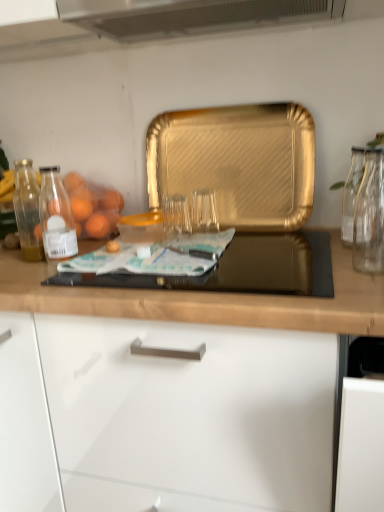
Measure the distance between transparent glass at center, the 1th glass jar from the left, and camera.

transparent glass at center, the 1th glass jar from the left, and camera are 1.19 meters apart from each other.

What is the approximate width of gold textured tray at center?

The width of gold textured tray at center is 3.92 inches.

What do you see at coordinates (237, 162) in the screenshot?
I see `gold textured tray at center` at bounding box center [237, 162].

Locate an element on the screen. Image resolution: width=384 pixels, height=512 pixels. transparent glass at center, which appears as the 2th glass jar when viewed from the right is located at coordinates (175, 217).

Is point (209, 163) positioned behind point (289, 237)?

That is True.

Considering the relative sizes of gold textured tray at center and black glass gas stove at center in the image provided, is gold textured tray at center thinner than black glass gas stove at center?

Yes.

Can you confirm if gold textured tray at center is positioned to the left of black glass gas stove at center?

No, gold textured tray at center is not to the left of black glass gas stove at center.

Does gold textured tray at center have a greater height compared to black glass gas stove at center?

Indeed, gold textured tray at center has a greater height compared to black glass gas stove at center.

Which is more to the right, translucent glass oranges at left or clear glass vase at right, marked as the 1th glass jar in a right-to-left arrangement?

clear glass vase at right, marked as the 1th glass jar in a right-to-left arrangement, is more to the right.

Is translucent glass oranges at left aimed at clear glass vase at right, the second glass jar viewed from the left?

No.

Is clear glass vase at right, marked as the 1th glass jar in a right-to-left arrangement, completely or partially inside translucent glass oranges at left?

Definitely not — clear glass vase at right, marked as the 1th glass jar in a right-to-left arrangement, is not inside translucent glass oranges at left.

Considering the relative positions of black glass gas stove at center and gold textured tray at center in the image provided, is black glass gas stove at center to the right of gold textured tray at center from the viewer's perspective?

Incorrect, black glass gas stove at center is not on the right side of gold textured tray at center.

Can we say black glass gas stove at center lies outside gold textured tray at center?

black glass gas stove at center lies outside gold textured tray at center's area.

Are black glass gas stove at center and gold textured tray at center located far from each other?

No.

Is black glass gas stove at center oriented away from gold textured tray at center?

black glass gas stove at center does not have its back to gold textured tray at center.

From the image's perspective, which glass jar is the 1st one below the gold textured tray at center? Please provide its 2D coordinates.

[(353, 191)]

Which of these two, clear glass vase at right, marked as the 1th glass jar in a right-to-left arrangement, or gold textured tray at center, stands shorter?

clear glass vase at right, marked as the 1th glass jar in a right-to-left arrangement.

Considering the positions of objects clear glass vase at right, the second glass jar viewed from the left, and gold textured tray at center in the image provided, who is behind, clear glass vase at right, the second glass jar viewed from the left, or gold textured tray at center?

gold textured tray at center is further from the camera.

From the image's perspective, relative to translucent glass oranges at left, is clear glass vase at right, marked as the 1th glass jar in a right-to-left arrangement, above or below?

From the image's perspective, clear glass vase at right, marked as the 1th glass jar in a right-to-left arrangement, appears above translucent glass oranges at left.

Could translucent glass oranges at left be considered to be inside clear glass vase at right, the second glass jar viewed from the left?

No, translucent glass oranges at left is not surrounded by clear glass vase at right, the second glass jar viewed from the left.

From the picture: Based on their sizes in the image, would you say clear glass vase at right, marked as the 1th glass jar in a right-to-left arrangement, is bigger or smaller than translucent glass oranges at left?

Considering their sizes, clear glass vase at right, marked as the 1th glass jar in a right-to-left arrangement, takes up less space than translucent glass oranges at left.

Could you tell me if clear glass vase at right, the second glass jar viewed from the left, is turned towards translucent glass oranges at left?

No.

Considering the relative sizes of black glass gas stove at center and clear glass vase at right, marked as the 1th glass jar in a right-to-left arrangement, in the image provided, is black glass gas stove at center bigger than clear glass vase at right, marked as the 1th glass jar in a right-to-left arrangement,?

Indeed, black glass gas stove at center has a larger size compared to clear glass vase at right, marked as the 1th glass jar in a right-to-left arrangement.

Considering the relative sizes of black glass gas stove at center and clear glass vase at right, the second glass jar viewed from the left, in the image provided, is black glass gas stove at center wider than clear glass vase at right, the second glass jar viewed from the left,?

Indeed, black glass gas stove at center has a greater width compared to clear glass vase at right, the second glass jar viewed from the left.

From a real-world perspective, does black glass gas stove at center stand above clear glass vase at right, the second glass jar viewed from the left?

No.

This screenshot has width=384, height=512. What are the coordinates of `kitchen appliance that appears behind the translucent glass oranges at left` in the screenshot? It's located at (237, 162).

Is translucent glass oranges at left turned away from gold textured tray at center?

No, translucent glass oranges at left is not facing away from gold textured tray at center.

Does translucent glass oranges at left contain gold textured tray at center?

Definitely not — gold textured tray at center is not inside translucent glass oranges at left.

Considering the relative positions of translucent glass oranges at left and gold textured tray at center in the image provided, is translucent glass oranges at left to the right of gold textured tray at center from the viewer's perspective?

In fact, translucent glass oranges at left is to the left of gold textured tray at center.

Identify the location of gas stove directly beneath the gold textured tray at center (from a real-world perspective). Image resolution: width=384 pixels, height=512 pixels. (x=240, y=269).

This screenshot has height=512, width=384. Identify the location of fruit on the left of clear glass vase at right, marked as the 1th glass jar in a right-to-left arrangement. (93, 207).

Estimate the real-world distances between objects in this image. Which object is closer to gold textured tray at center, transparent glass at center, the 1th glass jar from the left, or clear glass vase at right, marked as the 1th glass jar in a right-to-left arrangement?

Based on the image, transparent glass at center, the 1th glass jar from the left, appears to be nearer to gold textured tray at center.

Looking at the image, which one is located closer to clear glass vase at right, marked as the 1th glass jar in a right-to-left arrangement, black glass gas stove at center or transparent glass at center, the 1th glass jar from the left?

black glass gas stove at center lies closer to clear glass vase at right, marked as the 1th glass jar in a right-to-left arrangement, than the other object.

Considering their positions, is clear glass vase at right, marked as the 1th glass jar in a right-to-left arrangement, positioned further to black glass gas stove at center than transparent glass at center, the 1th glass jar from the left?

transparent glass at center, the 1th glass jar from the left.

From the image, which object appears to be farther from clear glass vase at right, marked as the 1th glass jar in a right-to-left arrangement, black glass gas stove at center or gold textured tray at center?

The object further to clear glass vase at right, marked as the 1th glass jar in a right-to-left arrangement, is gold textured tray at center.

When comparing their distances from transparent glass at center, the 1th glass jar from the left, does clear glass vase at right, the second glass jar viewed from the left, or translucent glass oranges at left seem further?

clear glass vase at right, the second glass jar viewed from the left, lies further to transparent glass at center, the 1th glass jar from the left, than the other object.

Estimate the real-world distances between objects in this image. Which object is closer to black glass gas stove at center, gold textured tray at center or translucent glass oranges at left?

gold textured tray at center is closer to black glass gas stove at center.

Considering their positions, is transparent glass at center, which appears as the 2th glass jar when viewed from the right, positioned further to black glass gas stove at center than gold textured tray at center?

transparent glass at center, which appears as the 2th glass jar when viewed from the right, is positioned further to the anchor black glass gas stove at center.

From the image, which object appears to be farther from translucent glass oranges at left, clear glass vase at right, the second glass jar viewed from the left, or black glass gas stove at center?

clear glass vase at right, the second glass jar viewed from the left, lies further to translucent glass oranges at left than the other object.

This screenshot has width=384, height=512. Identify the location of gas stove between translucent glass oranges at left and clear glass vase at right, marked as the 1th glass jar in a right-to-left arrangement, in the horizontal direction. (240, 269).

Find the location of `glass jar located between translucent glass oranges at left and gold textured tray at center in the left-right direction`. glass jar located between translucent glass oranges at left and gold textured tray at center in the left-right direction is located at coordinates (175, 217).

Locate an element on the screen. kitchen appliance situated between transparent glass at center, the 1th glass jar from the left, and clear glass vase at right, marked as the 1th glass jar in a right-to-left arrangement, from left to right is located at coordinates (237, 162).

This screenshot has width=384, height=512. Identify the location of gas stove situated between transparent glass at center, which appears as the 2th glass jar when viewed from the right, and clear glass vase at right, the second glass jar viewed from the left, from left to right. (240, 269).